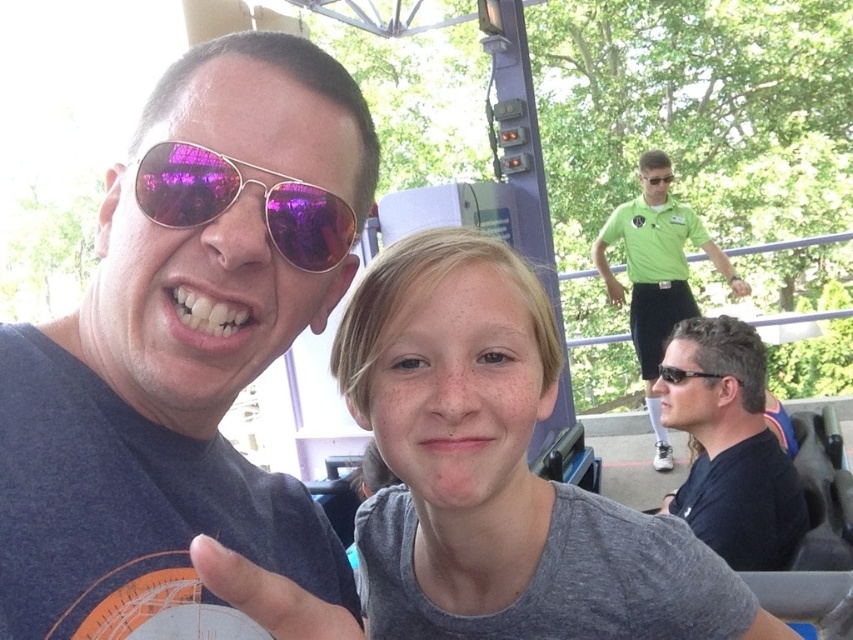
You are a photographer taking a picture of the scene. You want to ensure that both the black matte sunglasses at lower right and the black plastic sunglasses at right are in focus. The camera you are using has a depth of field that can cover 8 inches. Can both objects be in focus simultaneously?

The black matte sunglasses at lower right is 7.71 inches from black plastic sunglasses at right. Since the distance between them is less than the camera depth of field of 8 inches, both objects can be in focus simultaneously.

You are designing a display stand for sunglasses and need to know the relative sizes of the metallic aviator sunglasses at left and the green fabric shirt at upper right. Based on the scene, can you determine which one is wider?

The green fabric shirt at upper right might be wider than metallic aviator sunglasses at left.

You are standing at the amusement park and want to take a photo of the point at coordinates (656,413). If your camera has a maximum focus range of 15 feet, will it be able to focus on that point?

The distance of point (656,413) from the viewer is 15.16 feet, which is slightly beyond the camera maximum focus range of 15 feet. Therefore, the camera will not be able to focus on that point.